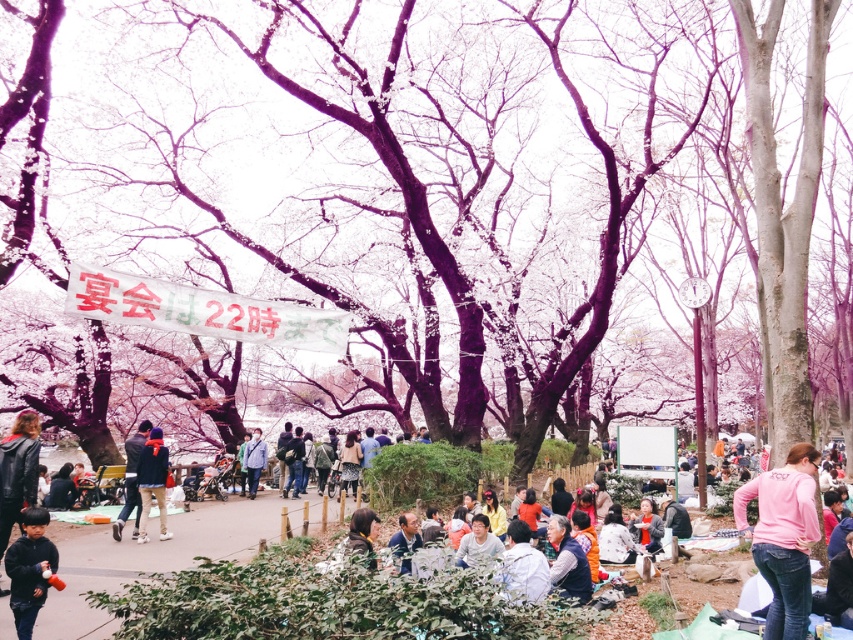
You are standing in the park and see a point marked at coordinates [782,538]. Which object is this point located on?

The point at coordinates [782,538] is located on the pink cotton shirt at lower right.